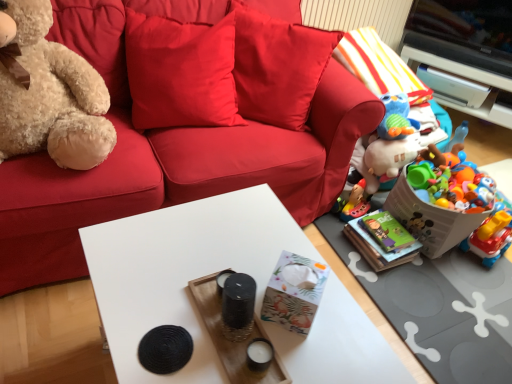
Locate an element on the screen. The image size is (512, 384). free space in front of plastic toy car at lower right, the third toy from the front is located at coordinates (492, 275).